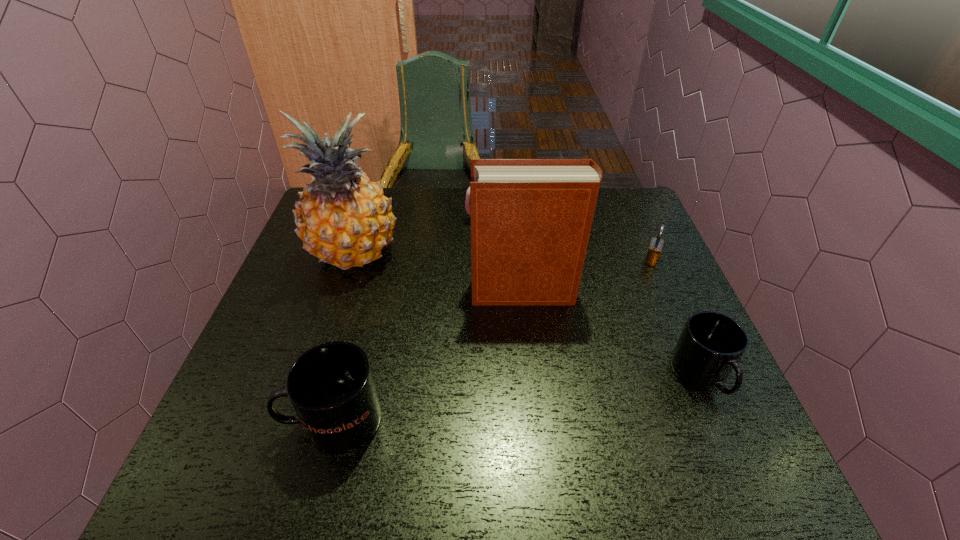
At what (x,y) coordinates should I click in order to perform the action: click on pineapple that is at the left edge. Please return your answer as a coordinate pair (x, y). The height and width of the screenshot is (540, 960). Looking at the image, I should click on [x=343, y=218].

Identify the location of mug located in the right edge section of the desktop. The image size is (960, 540). (711, 345).

You are a GUI agent. You are given a task and a screenshot of the screen. Output one action in this format:
    pyautogui.click(x=<x>, y=<y>)
    Task: Click on the padlock present at the right edge
    This screenshot has height=540, width=960.
    Given the screenshot: What is the action you would take?
    pyautogui.click(x=656, y=244)

Where is `object located at the far left corner`? object located at the far left corner is located at coordinates (343, 218).

Where is `object at the near left corner`? The height and width of the screenshot is (540, 960). object at the near left corner is located at coordinates (331, 387).

This screenshot has width=960, height=540. I want to click on object that is at the near right corner, so click(711, 345).

Find the location of a particular element. Image resolution: width=960 pixels, height=540 pixels. free space at the far edge of the desktop is located at coordinates (402, 187).

Where is `vacant space at the left edge of the desktop`? Image resolution: width=960 pixels, height=540 pixels. vacant space at the left edge of the desktop is located at coordinates (288, 272).

The width and height of the screenshot is (960, 540). I want to click on free space at the near left corner, so coord(277,422).

This screenshot has height=540, width=960. Identify the location of free space between the second tallest object and the rightmost mug. (612, 334).